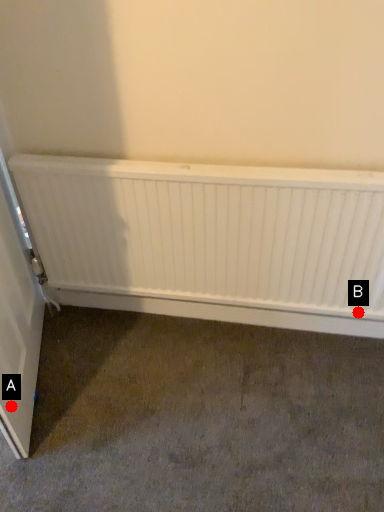
Question: Two points are circled on the image, labeled by A and B beside each circle. Which point appears farthest from the camera in this image?

Choices:
 (A) A is further
 (B) B is further

Answer: (B)